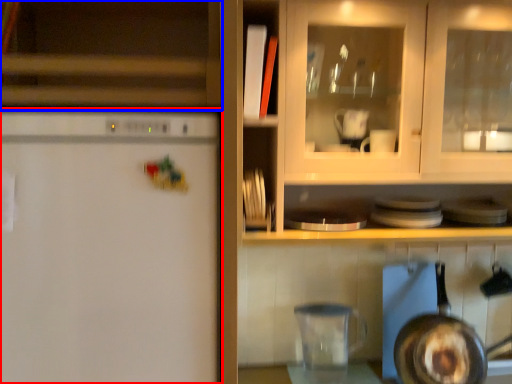
Question: Which of the following is the farthest to the observer, refrigerator (highlighted by a red box) or cabinetry (highlighted by a blue box)?

Choices:
 (A) refrigerator
 (B) cabinetry

Answer: (B)